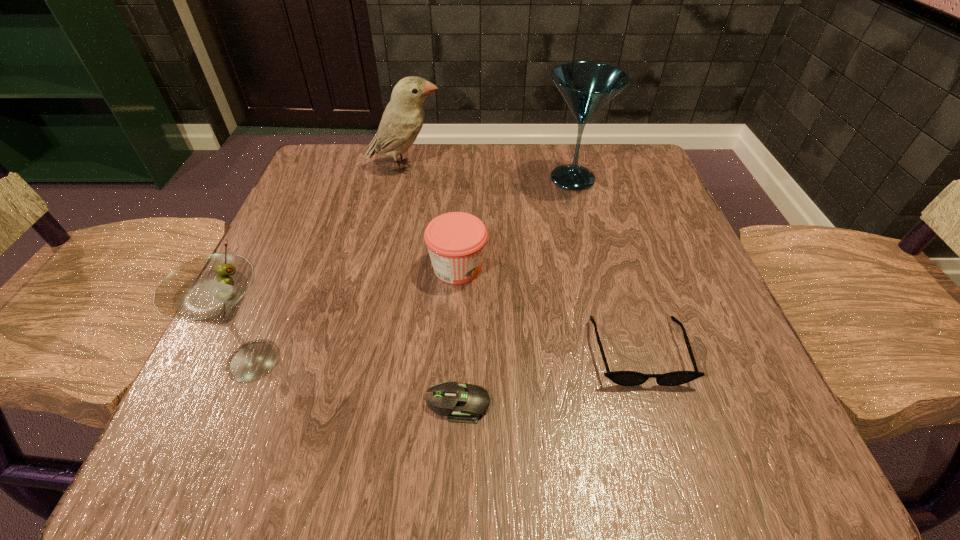
Where is `vacant region between the sunglasses and the third shortest object`? The height and width of the screenshot is (540, 960). vacant region between the sunglasses and the third shortest object is located at coordinates (548, 309).

Identify the location of object identified as the closest to the bird. Image resolution: width=960 pixels, height=540 pixels. (586, 86).

I want to click on object that is the third nearest to the bird, so click(210, 289).

At what (x,y) coordinates should I click in order to perform the action: click on vacant space that satisfies the following two spatial constraints: 1. at the face of the bird; 2. on the back side of the shortest object. Please return your answer as a coordinate pair (x, y). Image resolution: width=960 pixels, height=540 pixels. Looking at the image, I should click on (354, 403).

The width and height of the screenshot is (960, 540). Identify the location of free space that satisfies the following two spatial constraints: 1. at the face of the bird; 2. on the right side of the right martini. (402, 179).

You are a GUI agent. You are given a task and a screenshot of the screen. Output one action in this format:
    pyautogui.click(x=<x>, y=<y>)
    Task: Click on the vacant area in the image that satisfies the following two spatial constraints: 1. on the front side of the taller martini; 2. on the front label of the fourth nearest object
    The height and width of the screenshot is (540, 960).
    Given the screenshot: What is the action you would take?
    pyautogui.click(x=595, y=267)